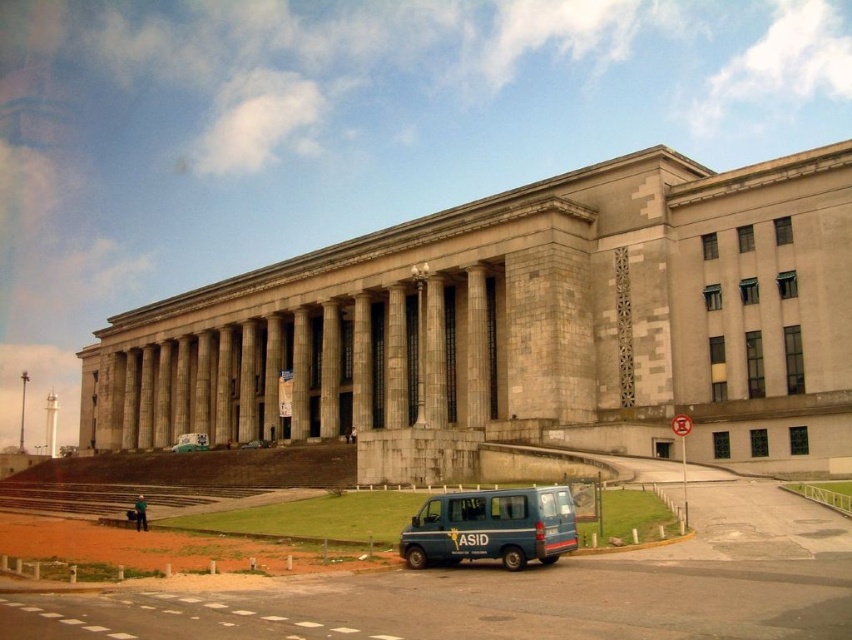
Question: Can you confirm if blue metallic van at lower center is positioned below metallic blue van at center?

Choices:
 (A) yes
 (B) no

Answer: (B)

Question: Does blue metallic van at lower center appear over metallic blue van at center?

Choices:
 (A) no
 (B) yes

Answer: (B)

Question: Which of the following is the farthest from the observer?

Choices:
 (A) (419, 538)
 (B) (248, 442)

Answer: (B)

Question: Is blue metallic van at lower center bigger than metallic blue van at center?

Choices:
 (A) yes
 (B) no

Answer: (A)